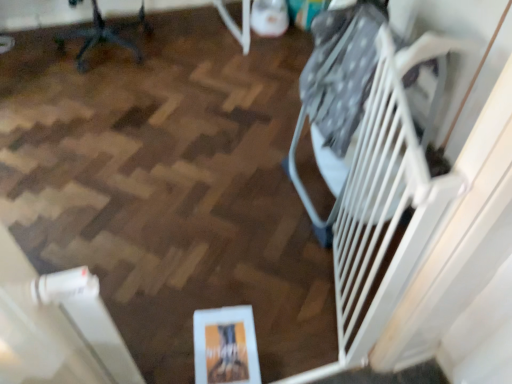
Question: Is white plastic gate at right inside or outside of metallic office chair at upper left?

Choices:
 (A) inside
 (B) outside

Answer: (B)

Question: From their relative heights in the image, would you say white plastic gate at right is taller or shorter than metallic office chair at upper left?

Choices:
 (A) short
 (B) tall

Answer: (B)

Question: From a real-world perspective, is white plastic gate at right physically located above or below metallic office chair at upper left?

Choices:
 (A) above
 (B) below

Answer: (A)

Question: Is point (120, 39) closer or farther from the camera than point (399, 173)?

Choices:
 (A) farther
 (B) closer

Answer: (A)

Question: From the image's perspective, is metallic office chair at upper left above or below white plastic gate at right?

Choices:
 (A) above
 (B) below

Answer: (A)

Question: From their relative heights in the image, would you say metallic office chair at upper left is taller or shorter than white plastic gate at right?

Choices:
 (A) tall
 (B) short

Answer: (B)

Question: Looking at the image, does metallic office chair at upper left seem bigger or smaller compared to white plastic gate at right?

Choices:
 (A) small
 (B) big

Answer: (B)